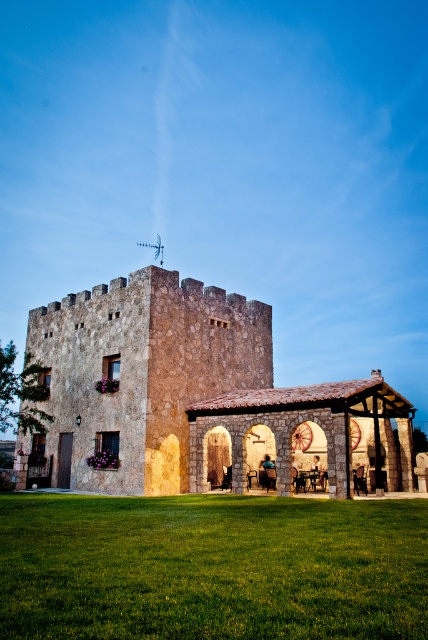
You are planning to host a small picnic in the green grass at lower center. Considering the space available, how many people can comfortably sit there without overlapping the rustic stone castle at center?

The green grass at lower center occupies less space than the rustic stone castle at center, so it can comfortably accommodate a small group of 2 to 3 people without overlapping the castle area.

You are standing in front of the stone building and want to walk towards the green grass at lower center. Which direction should you move relative to the rustic stone castle at center?

Since the green grass at lower center is closer to the viewer than the rustic stone castle at center, you should move towards the green grass at lower center, which is in front of the rustic stone castle at center.

You are a gardener who wants to plant a new tree in the green grass at lower center. Considering the height of the rustic stone castle at center, will the tree grow taller than the castle if it reaches its maximum height of 20 meters?

The green grass at lower center has a lesser height compared to rustic stone castle at center. Since the castle is taller than the grass, the tree planted in the green grass at lower center could potentially grow to 20 meters, which is taller than the castle if the castle is shorter than 20 meters. However, without knowing the exact height of the castle, we cannot definitively say if the tree will surpass it.